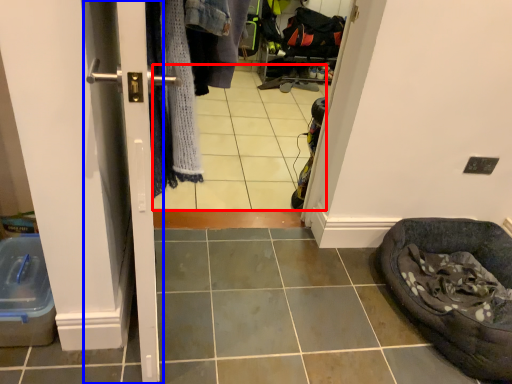
Question: Among these objects, which one is nearest to the camera, tile (highlighted by a red box) or screen door (highlighted by a blue box)?

Choices:
 (A) tile
 (B) screen door

Answer: (B)